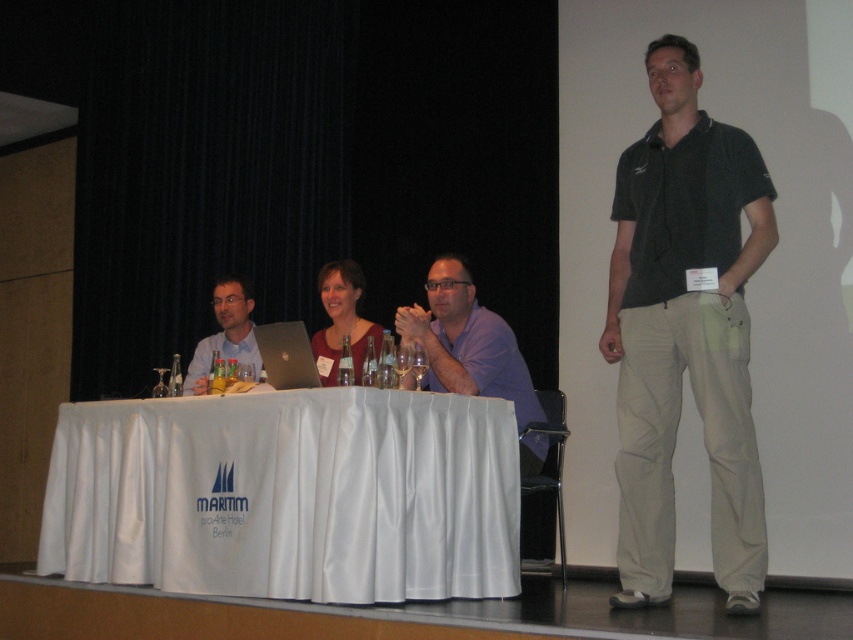
Who is positioned more to the right, dark green polo shirt at center or purple cotton shirt at center?

dark green polo shirt at center

Is dark green polo shirt at center positioned at the back of purple cotton shirt at center?

No, dark green polo shirt at center is in front of purple cotton shirt at center.

This screenshot has width=853, height=640. What do you see at coordinates (685, 332) in the screenshot? I see `dark green polo shirt at center` at bounding box center [685, 332].

The image size is (853, 640). Find the location of `dark green polo shirt at center`. dark green polo shirt at center is located at coordinates (685, 332).

Can you confirm if white satin table at center is shorter than purple cotton shirt at center?

Correct, white satin table at center is not as tall as purple cotton shirt at center.

Does white satin table at center appear over purple cotton shirt at center?

Incorrect, white satin table at center is not positioned above purple cotton shirt at center.

This screenshot has height=640, width=853. Describe the element at coordinates (288, 496) in the screenshot. I see `white satin table at center` at that location.

The height and width of the screenshot is (640, 853). In order to click on white satin table at center in this screenshot , I will do `click(288, 496)`.

The image size is (853, 640). Describe the element at coordinates (466, 342) in the screenshot. I see `purple cotton shirt at center` at that location.

Does purple cotton shirt at center have a smaller size compared to silver metallic laptop at center?

No, purple cotton shirt at center is not smaller than silver metallic laptop at center.

You are a GUI agent. You are given a task and a screenshot of the screen. Output one action in this format:
    pyautogui.click(x=<x>, y=<y>)
    Task: Click on the purple cotton shirt at center
    The image size is (853, 640).
    Given the screenshot: What is the action you would take?
    pyautogui.click(x=466, y=342)